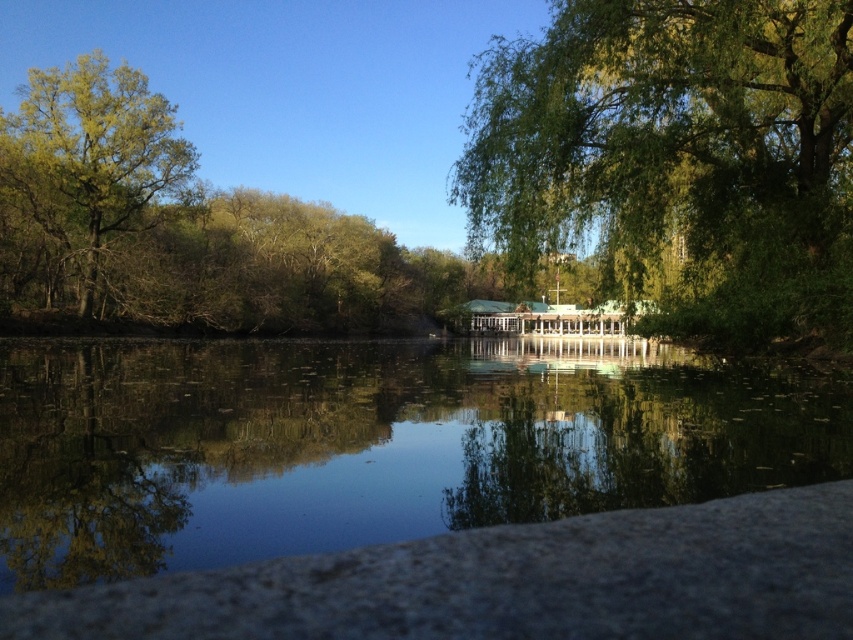
Question: Which point appears farthest from the camera in this image?

Choices:
 (A) (33, 234)
 (B) (730, 168)

Answer: (A)

Question: Estimate the real-world distances between objects in this image. Which object is farther from the green leafy tree at upper right?

Choices:
 (A) green leafy tree at left
 (B) smooth reflective water at center

Answer: (A)

Question: Is green leafy tree at upper right above green leafy tree at left?

Choices:
 (A) no
 (B) yes

Answer: (B)

Question: In this image, where is smooth reflective water at center located relative to green leafy tree at upper right?

Choices:
 (A) left
 (B) right

Answer: (A)

Question: Can you confirm if smooth reflective water at center is thinner than green leafy tree at upper right?

Choices:
 (A) yes
 (B) no

Answer: (B)

Question: Which object is positioned closest to the green leafy tree at left?

Choices:
 (A) smooth reflective water at center
 (B) green leafy tree at upper right

Answer: (A)